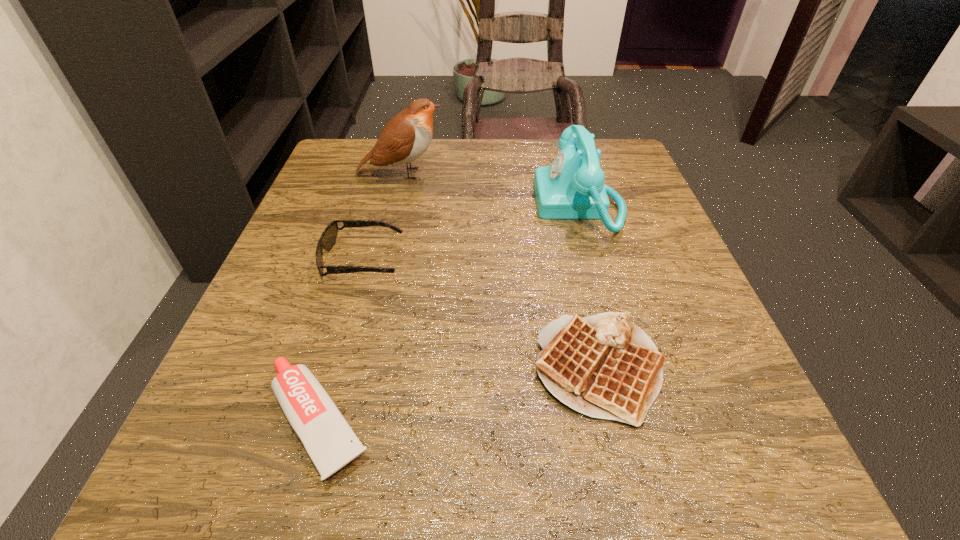
This screenshot has height=540, width=960. Find the location of `blank area located 0.120m on the back of the waffle`. blank area located 0.120m on the back of the waffle is located at coordinates (575, 265).

This screenshot has height=540, width=960. I want to click on vacant space located 0.250m on the right of the toothpaste, so click(x=576, y=421).

Locate an element on the screen. The width and height of the screenshot is (960, 540). bird at the far edge is located at coordinates (405, 138).

Image resolution: width=960 pixels, height=540 pixels. I want to click on telephone present at the far edge, so click(572, 187).

At what (x,y) coordinates should I click in order to perform the action: click on object located in the near edge section of the desktop. Please return your answer as a coordinate pair (x, y). The height and width of the screenshot is (540, 960). Looking at the image, I should click on (330, 442).

At what (x,y) coordinates should I click in order to perform the action: click on bird positioned at the left edge. Please return your answer as a coordinate pair (x, y). Looking at the image, I should click on (405, 138).

Locate an element on the screen. sunglasses that is at the left edge is located at coordinates click(x=328, y=238).

Locate an element on the screen. toothpaste located at the left edge is located at coordinates (330, 442).

Where is `telephone positioned at the right edge`? The height and width of the screenshot is (540, 960). telephone positioned at the right edge is located at coordinates (572, 187).

This screenshot has height=540, width=960. What are the coordinates of `waffle present at the right edge` in the screenshot? It's located at coord(604,366).